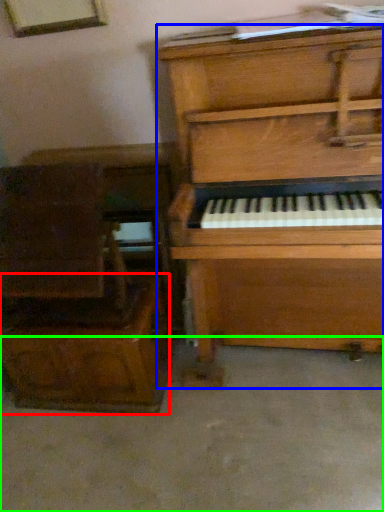
Question: Estimate the real-world distances between objects in this image. Which object is closer to drawer (highlighted by a red box), piano (highlighted by a blue box) or concrete (highlighted by a green box)?

Choices:
 (A) piano
 (B) concrete

Answer: (B)